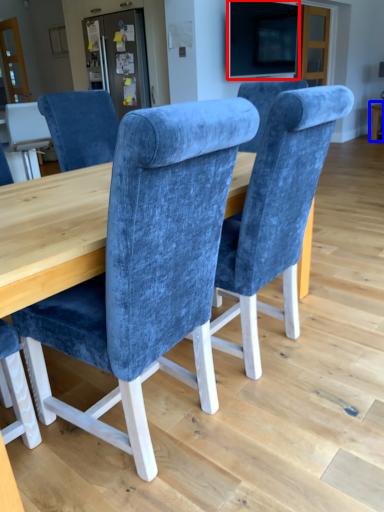
Question: Which of the following is the farthest to the observer, television (highlighted by a red box) or table (highlighted by a blue box)?

Choices:
 (A) television
 (B) table

Answer: (B)